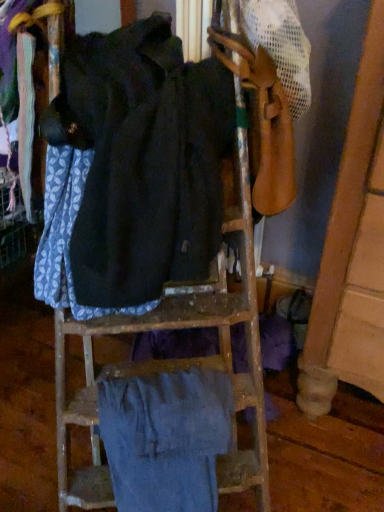
The height and width of the screenshot is (512, 384). What do you see at coordinates (132, 170) in the screenshot? I see `dark blue fabric at center, which is the 2th wide in bottom-to-top order` at bounding box center [132, 170].

Locate an element on the screen. This screenshot has width=384, height=512. dark blue fabric at center, which is the 2th wide in bottom-to-top order is located at coordinates (132, 170).

In order to face denim pants at lower center, which ranks as the 2th wide in top-to-bottom order, should I rotate leftwards or rightwards?

To align with it, rotate left about 2.906°.

Describe the element at coordinates (165, 439) in the screenshot. Image resolution: width=384 pixels, height=512 pixels. I see `denim pants at lower center, placed as the first wide when sorted from bottom to top` at that location.

How much space does denim pants at lower center, placed as the first wide when sorted from bottom to top, occupy horizontally?

The width of denim pants at lower center, placed as the first wide when sorted from bottom to top, is 26.97 centimeters.

The width and height of the screenshot is (384, 512). Identify the location of denim pants at lower center, placed as the first wide when sorted from bottom to top. (165, 439).

Find the location of `dark blue fabric at center, which is the 2th wide in bottom-to-top order`. dark blue fabric at center, which is the 2th wide in bottom-to-top order is located at coordinates (132, 170).

Is denim pants at lower center, placed as the first wide when sorted from bottom to top, to the right of dark blue fabric at center, the first wide positioned from the top, from the viewer's perspective?

Correct, you'll find denim pants at lower center, placed as the first wide when sorted from bottom to top, to the right of dark blue fabric at center, the first wide positioned from the top.

Consider the image. Is denim pants at lower center, which ranks as the 2th wide in top-to-bottom order, in front of dark blue fabric at center, the first wide positioned from the top?

No, denim pants at lower center, which ranks as the 2th wide in top-to-bottom order, is further to the viewer.

Which point is more distant from viewer, (190, 476) or (100, 33)?

The point (100, 33) is more distant.

From the image's perspective, is denim pants at lower center, which ranks as the 2th wide in top-to-bottom order, above dark blue fabric at center, which is the 2th wide in bottom-to-top order?

No.

Looking at this image, from a real-world perspective, is denim pants at lower center, placed as the first wide when sorted from bottom to top, positioned above or below dark blue fabric at center, the first wide positioned from the top?

In terms of real-world spatial position, denim pants at lower center, placed as the first wide when sorted from bottom to top, is below dark blue fabric at center, the first wide positioned from the top.

Does denim pants at lower center, which ranks as the 2th wide in top-to-bottom order, have a lesser width compared to dark blue fabric at center, the first wide positioned from the top?

Yes.

In terms of height, does denim pants at lower center, which ranks as the 2th wide in top-to-bottom order, look taller or shorter compared to dark blue fabric at center, which is the 2th wide in bottom-to-top order?

Considering their sizes, denim pants at lower center, which ranks as the 2th wide in top-to-bottom order, has less height than dark blue fabric at center, which is the 2th wide in bottom-to-top order.

Is denim pants at lower center, placed as the first wide when sorted from bottom to top, smaller than dark blue fabric at center, the first wide positioned from the top?

Yes, denim pants at lower center, placed as the first wide when sorted from bottom to top, is smaller than dark blue fabric at center, the first wide positioned from the top.

Is denim pants at lower center, which ranks as the 2th wide in top-to-bottom order, positioned beyond the bounds of dark blue fabric at center, which is the 2th wide in bottom-to-top order?

Yes.

Does denim pants at lower center, placed as the first wide when sorted from bottom to top, touch dark blue fabric at center, which is the 2th wide in bottom-to-top order?

No.

Is denim pants at lower center, placed as the first wide when sorted from bottom to top, aimed at dark blue fabric at center, which is the 2th wide in bottom-to-top order?

No, denim pants at lower center, placed as the first wide when sorted from bottom to top, is not turned towards dark blue fabric at center, which is the 2th wide in bottom-to-top order.

How different are the orientations of denim pants at lower center, which ranks as the 2th wide in top-to-bottom order, and dark blue fabric at center, the first wide positioned from the top, in degrees?

The facing directions of denim pants at lower center, which ranks as the 2th wide in top-to-bottom order, and dark blue fabric at center, the first wide positioned from the top, are 0.000364 degrees apart.

At what (x,y) coordinates should I click in order to perform the action: click on wide on the right side of dark blue fabric at center, which is the 2th wide in bottom-to-top order. Please return your answer as a coordinate pair (x, y). This screenshot has width=384, height=512. Looking at the image, I should click on (165, 439).

In the image, is dark blue fabric at center, the first wide positioned from the top, on the left side or the right side of denim pants at lower center, placed as the first wide when sorted from bottom to top?

From the image, it's evident that dark blue fabric at center, the first wide positioned from the top, is to the left of denim pants at lower center, placed as the first wide when sorted from bottom to top.

Is dark blue fabric at center, the first wide positioned from the top, behind denim pants at lower center, which ranks as the 2th wide in top-to-bottom order?

No.

Which is nearer, [206,140] or [203,447]?

Point [206,140]

From the image's perspective, is dark blue fabric at center, the first wide positioned from the top, under denim pants at lower center, which ranks as the 2th wide in top-to-bottom order?

Incorrect, from the image's perspective, dark blue fabric at center, the first wide positioned from the top, is higher than denim pants at lower center, which ranks as the 2th wide in top-to-bottom order.

From the picture: From a real-world perspective, relative to denim pants at lower center, placed as the first wide when sorted from bottom to top, is dark blue fabric at center, which is the 2th wide in bottom-to-top order, vertically above or below?

In terms of real-world spatial position, dark blue fabric at center, which is the 2th wide in bottom-to-top order, is above denim pants at lower center, placed as the first wide when sorted from bottom to top.

Between dark blue fabric at center, which is the 2th wide in bottom-to-top order, and denim pants at lower center, which ranks as the 2th wide in top-to-bottom order, which one has smaller width?

With smaller width is denim pants at lower center, which ranks as the 2th wide in top-to-bottom order.

Looking at this image, considering the sizes of dark blue fabric at center, the first wide positioned from the top, and denim pants at lower center, which ranks as the 2th wide in top-to-bottom order, in the image, is dark blue fabric at center, the first wide positioned from the top, taller or shorter than denim pants at lower center, which ranks as the 2th wide in top-to-bottom order,?

Clearly, dark blue fabric at center, the first wide positioned from the top, is taller compared to denim pants at lower center, which ranks as the 2th wide in top-to-bottom order.

Between dark blue fabric at center, which is the 2th wide in bottom-to-top order, and denim pants at lower center, placed as the first wide when sorted from bottom to top, which one has larger size?

dark blue fabric at center, which is the 2th wide in bottom-to-top order, is bigger.

Do you think dark blue fabric at center, which is the 2th wide in bottom-to-top order, is within denim pants at lower center, placed as the first wide when sorted from bottom to top, or outside of it?

dark blue fabric at center, which is the 2th wide in bottom-to-top order, is not inside denim pants at lower center, placed as the first wide when sorted from bottom to top, it's outside.

Are dark blue fabric at center, which is the 2th wide in bottom-to-top order, and denim pants at lower center, which ranks as the 2th wide in top-to-bottom order, making contact?

dark blue fabric at center, which is the 2th wide in bottom-to-top order, and denim pants at lower center, which ranks as the 2th wide in top-to-bottom order, are clearly separated.

Could you tell me if dark blue fabric at center, the first wide positioned from the top, is facing denim pants at lower center, which ranks as the 2th wide in top-to-bottom order?

No, dark blue fabric at center, the first wide positioned from the top, is not facing towards denim pants at lower center, which ranks as the 2th wide in top-to-bottom order.

Find the location of `wide that appears below the dark blue fabric at center, the first wide positioned from the top (from the image's perspective)`. wide that appears below the dark blue fabric at center, the first wide positioned from the top (from the image's perspective) is located at coordinates (165, 439).

Identify the location of wide located above the denim pants at lower center, which ranks as the 2th wide in top-to-bottom order (from the image's perspective). This screenshot has height=512, width=384. (132, 170).

Where is `wide that appears behind the dark blue fabric at center, the first wide positioned from the top`? Image resolution: width=384 pixels, height=512 pixels. wide that appears behind the dark blue fabric at center, the first wide positioned from the top is located at coordinates (165, 439).